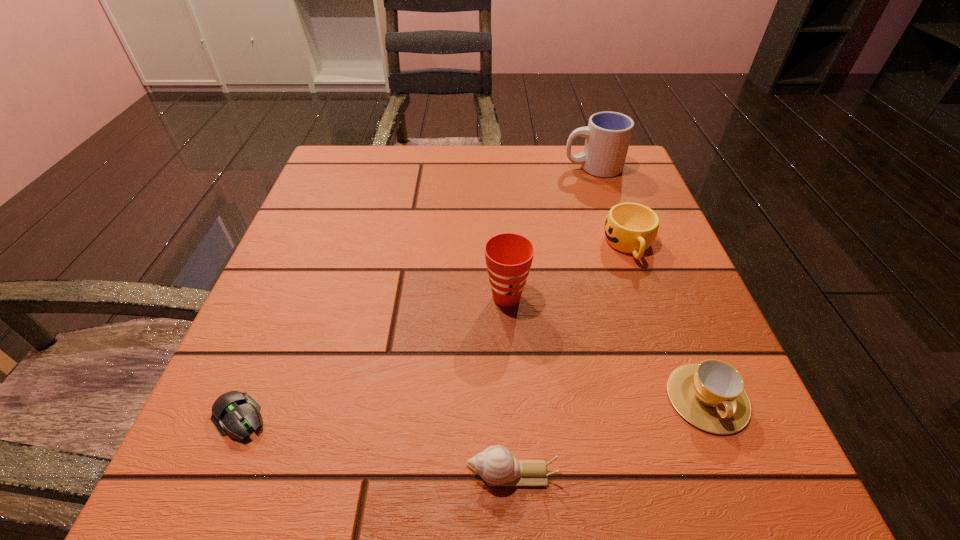
The width and height of the screenshot is (960, 540). Find the location of `computer mouse located at the near edge`. computer mouse located at the near edge is located at coordinates (233, 412).

Where is `object located in the left edge section of the desktop`? The height and width of the screenshot is (540, 960). object located in the left edge section of the desktop is located at coordinates (233, 412).

The height and width of the screenshot is (540, 960). Find the location of `object positioned at the near left corner`. object positioned at the near left corner is located at coordinates (233, 412).

This screenshot has width=960, height=540. Identify the location of object situated at the far right corner. (608, 134).

The image size is (960, 540). Identify the location of free region at the far edge of the desktop. (542, 181).

Identify the location of vacant region at the near edge. (634, 449).

You are a GUI agent. You are given a task and a screenshot of the screen. Output one action in this format:
    pyautogui.click(x=<x>, y=<y>)
    Task: Click on the free space at the left edge of the desktop
    
    Given the screenshot: What is the action you would take?
    pyautogui.click(x=245, y=345)

You are a GUI agent. You are given a task and a screenshot of the screen. Output one action in this format:
    pyautogui.click(x=<x>, y=<y>)
    Task: Click on the vacant region at the right edge
    The width and height of the screenshot is (960, 540).
    Given the screenshot: What is the action you would take?
    point(588,223)

This screenshot has height=540, width=960. Find the location of `free location at the far left corner`. free location at the far left corner is located at coordinates (357, 179).

Where is `vacant point at the near left corner`? Image resolution: width=960 pixels, height=540 pixels. vacant point at the near left corner is located at coordinates (206, 491).